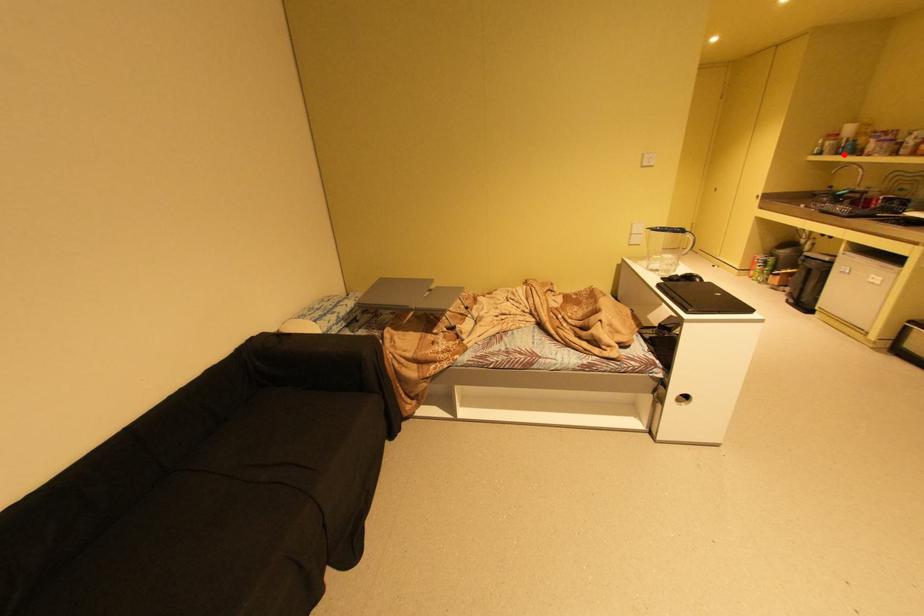
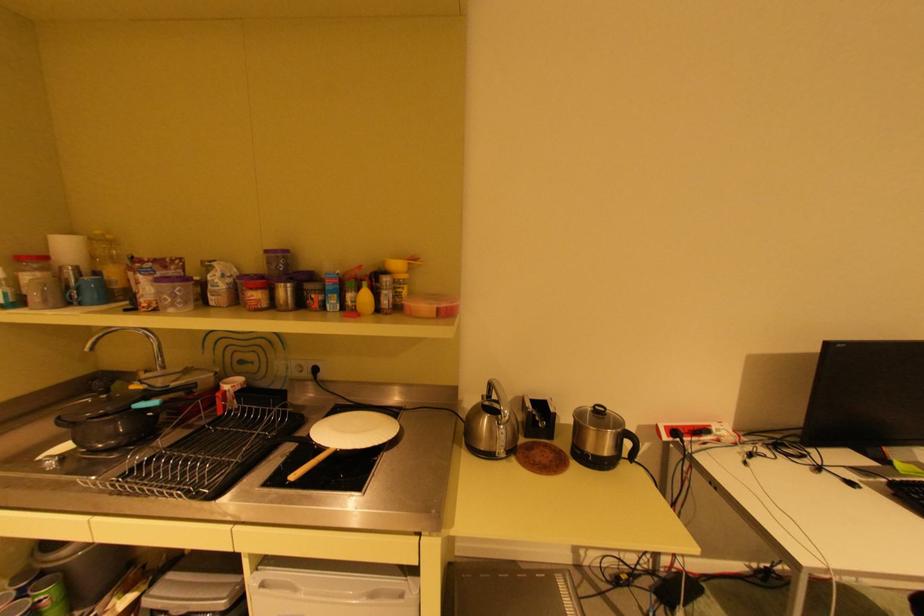
Find the pixel in the second image that matches the highlighted location in the first image.

(79, 302)